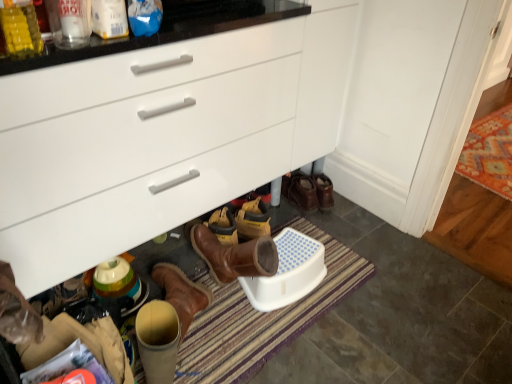
The width and height of the screenshot is (512, 384). Describe the element at coordinates (300, 191) in the screenshot. I see `leather shoes at center` at that location.

The width and height of the screenshot is (512, 384). What do you see at coordinates (489, 153) in the screenshot?
I see `orange patterned rug at lower right` at bounding box center [489, 153].

In the scene shown: What is the approximate width of leather handbag at lower left?

leather handbag at lower left is 11.50 inches wide.

At what (x,y) coordinates should I click in order to perform the action: click on white plastic phone at lower center. Please return your answer as a coordinate pair (x, y). Looking at the image, I should click on pos(288,272).

Locate an element on the screen. The image size is (512, 384). leather shoes at center is located at coordinates (300, 191).

Is white glossy cabinet at center located within orange patterned rug at lower right?

Actually, white glossy cabinet at center is outside orange patterned rug at lower right.

Between point (496, 138) and point (93, 221), which one is positioned behind?

The point (496, 138) is farther from the camera.

Locate an element on the screen. The height and width of the screenshot is (384, 512). cabinetry on the left of the orange patterned rug at lower right is located at coordinates tap(161, 136).

Considering the sizes of objects white plastic phone at lower center and leather shoes at center in the image provided, who is wider, white plastic phone at lower center or leather shoes at center?

leather shoes at center.

Does white plastic phone at lower center contain leather shoes at center?

No.

Which of these two, white plastic phone at lower center or leather shoes at center, is smaller?

leather shoes at center.

Which is behind, point (270, 301) or point (289, 200)?

Point (289, 200)

From the image's perspective, relative to leather shoes at center, is white glossy cabinet at center above or below?

Clearly, from the image's perspective, white glossy cabinet at center is above leather shoes at center.

Which object is closer to the camera taking this photo, white glossy cabinet at center or leather shoes at center?

white glossy cabinet at center is more forward.

Would you say white glossy cabinet at center is to the left or to the right of leather shoes at center in the picture?

white glossy cabinet at center is positioned on leather shoes at center's left side.

Is leather handbag at lower left positioned far away from white plastic phone at lower center?

No, leather handbag at lower left is not far away from white plastic phone at lower center.

Does leather handbag at lower left appear on the left side of white plastic phone at lower center?

Correct, you'll find leather handbag at lower left to the left of white plastic phone at lower center.

Is leather handbag at lower left oriented towards white plastic phone at lower center?

No, leather handbag at lower left is not turned towards white plastic phone at lower center.

Which point is more forward, (53, 324) or (310, 288)?

Point (53, 324)

From the image's perspective, is white glossy cabinet at center above striped fabric bath mat at lower center?

Yes, from the image's perspective, white glossy cabinet at center is above striped fabric bath mat at lower center.

Can you tell me how much white glossy cabinet at center and striped fabric bath mat at lower center differ in facing direction?

The facing directions of white glossy cabinet at center and striped fabric bath mat at lower center are 0.437 degrees apart.

Can you see white glossy cabinet at center touching striped fabric bath mat at lower center?

white glossy cabinet at center is not next to striped fabric bath mat at lower center, and they're not touching.

Considering the sizes of white glossy cabinet at center and striped fabric bath mat at lower center in the image, is white glossy cabinet at center bigger or smaller than striped fabric bath mat at lower center?

Clearly, white glossy cabinet at center is larger in size than striped fabric bath mat at lower center.

Considering their positions, is leather handbag at lower left located in front of or behind orange patterned rug at lower right?

Clearly, leather handbag at lower left is in front of orange patterned rug at lower right.

Considering the sizes of objects leather handbag at lower left and orange patterned rug at lower right in the image provided, who is wider, leather handbag at lower left or orange patterned rug at lower right?

Wider between the two is orange patterned rug at lower right.

Is orange patterned rug at lower right a part of leather handbag at lower left?

No, orange patterned rug at lower right is not inside leather handbag at lower left.

Is leather handbag at lower left far from orange patterned rug at lower right?

leather handbag at lower left is positioned a significant distance from orange patterned rug at lower right.

Is striped fabric bath mat at lower center aimed at leather shoes at center?

No, striped fabric bath mat at lower center does not turn towards leather shoes at center.

This screenshot has width=512, height=384. What are the coordinates of `footwear on the right side of striped fabric bath mat at lower center` in the screenshot? It's located at (300, 191).

Are striped fabric bath mat at lower center and leather shoes at center making contact?

No, striped fabric bath mat at lower center is not touching leather shoes at center.

Is striped fabric bath mat at lower center bigger than leather shoes at center?

Yes.

Identify the location of cabinetry above the orange patterned rug at lower right (from a real-world perspective). The width and height of the screenshot is (512, 384). (161, 136).

This screenshot has height=384, width=512. I want to click on footwear on the right of white plastic phone at lower center, so click(x=300, y=191).

Based on their spatial positions, is white plastic phone at lower center or leather shoes at center further from white glossy cabinet at center?

leather shoes at center.

Consider the image. Estimate the real-world distances between objects in this image. Which object is further from white plastic phone at lower center, orange patterned rug at lower right or white glossy cabinet at center?

orange patterned rug at lower right is positioned further to the anchor white plastic phone at lower center.

Considering their positions, is leather shoes at center positioned further to striped fabric bath mat at lower center than white glossy cabinet at center?

white glossy cabinet at center lies further to striped fabric bath mat at lower center than the other object.

From the image, which object appears to be nearer to striped fabric bath mat at lower center, white glossy cabinet at center or leather handbag at lower left?

leather handbag at lower left is closer to striped fabric bath mat at lower center.

Which object lies further to the anchor point leather handbag at lower left, white glossy cabinet at center or striped fabric bath mat at lower center?

white glossy cabinet at center is positioned further to the anchor leather handbag at lower left.

From the image, which object appears to be farther from orange patterned rug at lower right, striped fabric bath mat at lower center or leather shoes at center?

The object further to orange patterned rug at lower right is striped fabric bath mat at lower center.

Considering their positions, is leather shoes at center positioned further to white plastic phone at lower center than white glossy cabinet at center?

white glossy cabinet at center is positioned further to the anchor white plastic phone at lower center.

Based on their spatial positions, is leather handbag at lower left or orange patterned rug at lower right further from white glossy cabinet at center?

Among the two, orange patterned rug at lower right is located further to white glossy cabinet at center.

The height and width of the screenshot is (384, 512). Identify the location of bath mat between white glossy cabinet at center and leather handbag at lower left in the vertical direction. 261,317.

You are a GUI agent. You are given a task and a screenshot of the screen. Output one action in this format:
    pyautogui.click(x=<x>, y=<y>)
    Task: Click on the footwear between leather handbag at lower left and orange patterned rug at lower right in the horizontal direction
    
    Given the screenshot: What is the action you would take?
    pyautogui.click(x=300, y=191)

Where is `bath mat situated between white glossy cabinet at center and orange patterned rug at lower right from left to right`? The height and width of the screenshot is (384, 512). bath mat situated between white glossy cabinet at center and orange patterned rug at lower right from left to right is located at coordinates (261, 317).

In order to click on bath mat between white glossy cabinet at center and leather shoes at center in the front-back direction in this screenshot , I will do `click(261, 317)`.